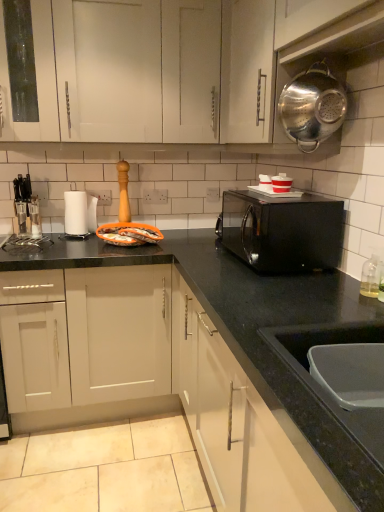
Question: Considering their positions, is matte black knife block at left, acting as the 2th appliance starting from the front, located in front of or behind white glossy cup at upper center, marked as the first appliance in a right-to-left arrangement?

Choices:
 (A) front
 (B) behind

Answer: (B)

Question: Looking at the image, does matte black knife block at left, acting as the 2th appliance starting from the front, seem bigger or smaller compared to white glossy cup at upper center, the 1th appliance in the front-to-back sequence?

Choices:
 (A) big
 (B) small

Answer: (A)

Question: Considering the real-world distances, which object is closest to the black glossy microwave at center?

Choices:
 (A) metallic silver colander at upper right
 (B) clear glass soap dispenser at right
 (C) polished stainless steel colander at upper right
 (D) white glossy cup at upper center, the 1th appliance in the front-to-back sequence
 (E) black granite countertop at lower center

Answer: (E)

Question: Which of these objects is positioned closest to the black granite countertop at lower center?

Choices:
 (A) metallic silver colander at upper right
 (B) white glossy cup at upper center, marked as the first appliance in a right-to-left arrangement
 (C) matte black knife block at left, acting as the 2th appliance starting from the front
 (D) clear glass soap dispenser at right
 (E) polished stainless steel colander at upper right

Answer: (D)